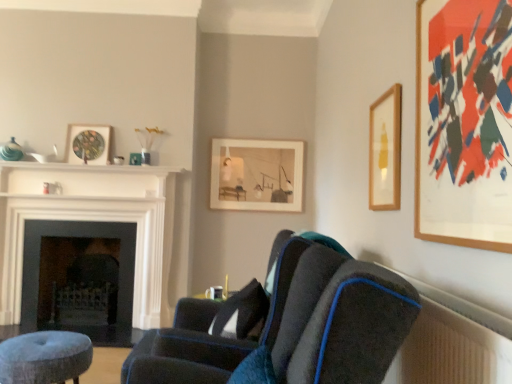
In order to face dark gray stone fireplace at left, which is the 2th fireplace in front-to-back order, should I rotate leftwards or rightwards?

To face it directly, rotate left by 21.501 degrees.

Describe the element at coordinates (257, 175) in the screenshot. I see `matte wooden picture frame at center, which appears as the first picture frame when viewed from the back` at that location.

Locate an element on the screen. white glossy balustrade at upper center is located at coordinates (90, 167).

Where is `wooden framed artwork at upper right, which is counted as the first picture frame, starting from the front`? wooden framed artwork at upper right, which is counted as the first picture frame, starting from the front is located at coordinates (464, 123).

Is point (380, 106) positioned in front of point (450, 137)?

No.

From the picture: From the image's perspective, who appears lower, wooden picture frame at upper right, the 3th picture frame viewed from the back, or wooden framed artwork at upper right, which appears as the first picture frame when viewed from the right?

wooden picture frame at upper right, the 3th picture frame viewed from the back, appears lower in the image.

Which object is further away from the camera taking this photo, wooden picture frame at upper right, the 3th picture frame viewed from the back, or wooden framed artwork at upper right, the fourth picture frame viewed from the left?

wooden picture frame at upper right, the 3th picture frame viewed from the back, is more distant.

From their relative heights in the image, would you say wooden picture frame at upper right, the second picture frame positioned from the front, is taller or shorter than wooden framed artwork at upper right, which appears as the first picture frame when viewed from the right?

wooden picture frame at upper right, the second picture frame positioned from the front, is shorter than wooden framed artwork at upper right, which appears as the first picture frame when viewed from the right.

Are wooden framed artwork at upper right, the fourth picture frame viewed from the left, and white glossy fireplace at left, the 2th fireplace positioned from the back, making contact?

wooden framed artwork at upper right, the fourth picture frame viewed from the left, and white glossy fireplace at left, the 2th fireplace positioned from the back, are clearly separated.

Is wooden framed artwork at upper right, which appears as the first picture frame when viewed from the right, smaller than white glossy fireplace at left, the 2th fireplace positioned from the back?

Correct, wooden framed artwork at upper right, which appears as the first picture frame when viewed from the right, occupies less space than white glossy fireplace at left, the 2th fireplace positioned from the back.

Considering the relative sizes of wooden framed artwork at upper right, the fourth picture frame viewed from the left, and white glossy fireplace at left, the 2th fireplace positioned from the back, in the image provided, is wooden framed artwork at upper right, the fourth picture frame viewed from the left, shorter than white glossy fireplace at left, the 2th fireplace positioned from the back,?

Indeed, wooden framed artwork at upper right, the fourth picture frame viewed from the left, has a lesser height compared to white glossy fireplace at left, the 2th fireplace positioned from the back.

Is matte glass picture frame at upper left, which is the first picture frame from left to right, in front of or behind white glossy fireplace at left, arranged as the first fireplace when viewed from the front, in the image?

Clearly, matte glass picture frame at upper left, which is the first picture frame from left to right, is behind white glossy fireplace at left, arranged as the first fireplace when viewed from the front.

Which object is positioned more to the right, matte glass picture frame at upper left, which is the first picture frame from left to right, or white glossy fireplace at left, arranged as the first fireplace when viewed from the front?

Positioned to the right is matte glass picture frame at upper left, which is the first picture frame from left to right.

In the scene shown: From a real-world perspective, between matte glass picture frame at upper left, which ranks as the 4th picture frame in right-to-left order, and white glossy fireplace at left, the 2th fireplace positioned from the back, who is vertically lower?

In real-world perspective, white glossy fireplace at left, the 2th fireplace positioned from the back, is lower.

Is matte glass picture frame at upper left, which is counted as the 3th picture frame, starting from the front, not near white glossy fireplace at left, the 2th fireplace positioned from the back?

No.

Which of these two, wooden framed artwork at upper right, which appears as the first picture frame when viewed from the right, or dark gray stone fireplace at left, which is the 2th fireplace in front-to-back order, is bigger?

With larger size is dark gray stone fireplace at left, which is the 2th fireplace in front-to-back order.

From a real-world perspective, who is located higher, wooden framed artwork at upper right, the fourth picture frame from the back, or dark gray stone fireplace at left, the 1th fireplace viewed from the back?

wooden framed artwork at upper right, the fourth picture frame from the back, from a real-world perspective.

From the image's perspective, is wooden framed artwork at upper right, the fourth picture frame viewed from the left, positioned above or below dark gray stone fireplace at left, which is the 2th fireplace in front-to-back order?

wooden framed artwork at upper right, the fourth picture frame viewed from the left, is situated higher than dark gray stone fireplace at left, which is the 2th fireplace in front-to-back order, in the image.

Is wooden framed artwork at upper right, the fourth picture frame from the back, taller than dark gray stone fireplace at left, which is the 2th fireplace in front-to-back order?

Correct, wooden framed artwork at upper right, the fourth picture frame from the back, is much taller as dark gray stone fireplace at left, which is the 2th fireplace in front-to-back order.

Is velvet dark blue chair at center inside wooden framed artwork at upper right, which appears as the first picture frame when viewed from the right?

No, velvet dark blue chair at center is not inside wooden framed artwork at upper right, which appears as the first picture frame when viewed from the right.

From the image's perspective, which one is positioned higher, wooden framed artwork at upper right, the fourth picture frame from the back, or velvet dark blue chair at center?

wooden framed artwork at upper right, the fourth picture frame from the back, from the image's perspective.

Considering the positions of objects wooden framed artwork at upper right, the fourth picture frame from the back, and velvet dark blue chair at center in the image provided, who is more to the left, wooden framed artwork at upper right, the fourth picture frame from the back, or velvet dark blue chair at center?

From the viewer's perspective, velvet dark blue chair at center appears more on the left side.

Is white glossy fireplace at left, the 2th fireplace positioned from the back, inside matte wooden picture frame at center, which is counted as the second picture frame, starting from the left?

Actually, white glossy fireplace at left, the 2th fireplace positioned from the back, is outside matte wooden picture frame at center, which is counted as the second picture frame, starting from the left.

Does matte wooden picture frame at center, arranged as the 4th picture frame when viewed from the front, have a greater height compared to white glossy fireplace at left, arranged as the first fireplace when viewed from the front?

No.

Locate an element on the screen. The width and height of the screenshot is (512, 384). fireplace that is the 1st one when counting downward from the matte wooden picture frame at center, arranged as the 4th picture frame when viewed from the front (from the image's perspective) is located at coordinates (94, 221).

Is matte wooden picture frame at center, the 3th picture frame from the right, oriented away from white glossy fireplace at left, the 2th fireplace positioned from the back?

That's not correct — matte wooden picture frame at center, the 3th picture frame from the right, is not looking away from white glossy fireplace at left, the 2th fireplace positioned from the back.

What's the angular difference between white glossy balustrade at upper center and matte wooden picture frame at center, arranged as the 4th picture frame when viewed from the front,'s facing directions?

The angular difference between white glossy balustrade at upper center and matte wooden picture frame at center, arranged as the 4th picture frame when viewed from the front, is 0.0252 degrees.

Looking at this image, between white glossy balustrade at upper center and matte wooden picture frame at center, which appears as the first picture frame when viewed from the back, which one has more height?

Standing taller between the two is matte wooden picture frame at center, which appears as the first picture frame when viewed from the back.

Is white glossy balustrade at upper center facing towards matte wooden picture frame at center, the 3th picture frame from the right?

No.

Between white glossy balustrade at upper center and matte wooden picture frame at center, arranged as the 4th picture frame when viewed from the front, which one has larger size?

Bigger between the two is matte wooden picture frame at center, arranged as the 4th picture frame when viewed from the front.

From a real-world perspective, starting from the wooden framed artwork at upper right, which appears as the first picture frame when viewed from the right, which picture frame is the 2nd one below it? Please provide its 2D coordinates.

[(385, 151)]

Identify the location of fireplace that is the 1st object located behind the wooden framed artwork at upper right, which is counted as the first picture frame, starting from the front. (94, 221).

When comparing their distances from dark gray stone fireplace at left, which is the 2th fireplace in front-to-back order, does matte glass picture frame at upper left, which ranks as the 4th picture frame in right-to-left order, or white glossy fireplace at left, arranged as the first fireplace when viewed from the front, seem closer?

white glossy fireplace at left, arranged as the first fireplace when viewed from the front, lies closer to dark gray stone fireplace at left, which is the 2th fireplace in front-to-back order, than the other object.

Looking at this image, from the image, which object appears to be nearer to dark gray stone fireplace at left, which is the 2th fireplace in front-to-back order, wooden picture frame at upper right, marked as the second picture frame in a right-to-left arrangement, or velvet blue stool at lower left?

velvet blue stool at lower left is positioned closer to the anchor dark gray stone fireplace at left, which is the 2th fireplace in front-to-back order.

Based on their spatial positions, is velvet dark blue chair at center or wooden framed artwork at upper right, which is counted as the first picture frame, starting from the front, further from white glossy balustrade at upper center?

Among the two, wooden framed artwork at upper right, which is counted as the first picture frame, starting from the front, is located further to white glossy balustrade at upper center.

From the picture: Considering their positions, is white glossy balustrade at upper center positioned further to velvet dark blue chair at center than matte wooden picture frame at center, which appears as the first picture frame when viewed from the back?

Based on the image, white glossy balustrade at upper center appears to be further to velvet dark blue chair at center.

Considering their positions, is matte wooden picture frame at center, the 3th picture frame from the right, positioned further to wooden framed artwork at upper right, which is counted as the first picture frame, starting from the front, than matte glass picture frame at upper left, which ranks as the second picture frame in back-to-front order?

Based on the image, matte glass picture frame at upper left, which ranks as the second picture frame in back-to-front order, appears to be further to wooden framed artwork at upper right, which is counted as the first picture frame, starting from the front.

From the image, which object appears to be nearer to velvet dark blue chair at center, wooden framed artwork at upper right, which appears as the first picture frame when viewed from the right, or white glossy fireplace at left, the 2th fireplace positioned from the back?

wooden framed artwork at upper right, which appears as the first picture frame when viewed from the right, is closer to velvet dark blue chair at center.

From the image, which object appears to be nearer to white glossy balustrade at upper center, wooden picture frame at upper right, the 3th picture frame positioned from the left, or dark gray stone fireplace at left, which is the 2th fireplace in front-to-back order?

Based on the image, dark gray stone fireplace at left, which is the 2th fireplace in front-to-back order, appears to be nearer to white glossy balustrade at upper center.

Looking at the image, which one is located further to velvet dark blue chair at center, wooden framed artwork at upper right, the fourth picture frame from the back, or white glossy balustrade at upper center?

Among the two, white glossy balustrade at upper center is located further to velvet dark blue chair at center.

Identify the location of stool between white glossy fireplace at left, the 2th fireplace positioned from the back, and wooden picture frame at upper right, marked as the second picture frame in a right-to-left arrangement. This screenshot has height=384, width=512. (45, 357).

Locate an element on the screen. fireplace positioned between wooden framed artwork at upper right, the fourth picture frame viewed from the left, and dark gray stone fireplace at left, which is the 2th fireplace in front-to-back order, from near to far is located at coordinates (94, 221).

Identify the location of balustrade between wooden framed artwork at upper right, the fourth picture frame viewed from the left, and matte wooden picture frame at center, arranged as the 4th picture frame when viewed from the front, from front to back. The image size is (512, 384). (90, 167).

You are a GUI agent. You are given a task and a screenshot of the screen. Output one action in this format:
    pyautogui.click(x=<x>, y=<y>)
    Task: Click on the balustrade between dark gray stone fireplace at left, which is the 2th fireplace in front-to-back order, and wooden picture frame at upper right, marked as the second picture frame in a right-to-left arrangement, from left to right
    This screenshot has height=384, width=512.
    Given the screenshot: What is the action you would take?
    pyautogui.click(x=90, y=167)